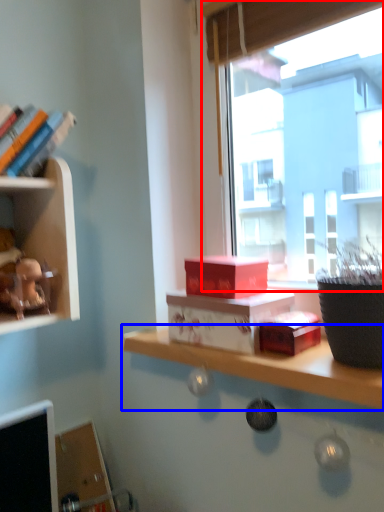
Question: Which of the following is the closest to the observer, window (highlighted by a red box) or shelf (highlighted by a blue box)?

Choices:
 (A) window
 (B) shelf

Answer: (B)